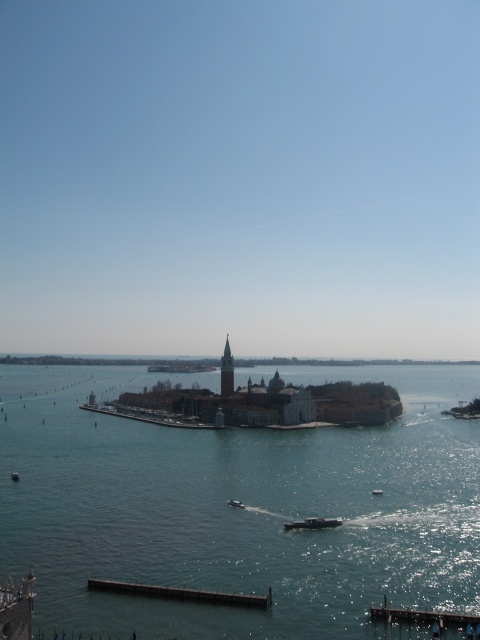
Question: Based on their relative distances, which object is nearer to the white plastic boat at center?

Choices:
 (A) metallic silver boat at center
 (B) clear blue water at center
 (C) metallic gray boat at center
 (D) dark gray concrete dock at lower center

Answer: (C)

Question: Observing the image, what is the correct spatial positioning of wooden planks at lower right in reference to white plastic boat at center?

Choices:
 (A) left
 (B) right

Answer: (A)

Question: Can you confirm if wooden planks at lower right is positioned above metallic silver boat at center?

Choices:
 (A) no
 (B) yes

Answer: (B)

Question: Can you confirm if dark gray concrete dock at lower center is positioned to the left of metallic silver boat at center?

Choices:
 (A) no
 (B) yes

Answer: (B)

Question: Which object is the closest to the metallic silver boat at center?

Choices:
 (A) white plastic boat at center
 (B) dark gray concrete dock at lower center
 (C) clear blue water at center

Answer: (A)

Question: Which object appears closest to the camera in this image?

Choices:
 (A) metallic silver boat at center
 (B) wooden planks at lower right
 (C) dark gray concrete dock at lower center

Answer: (B)